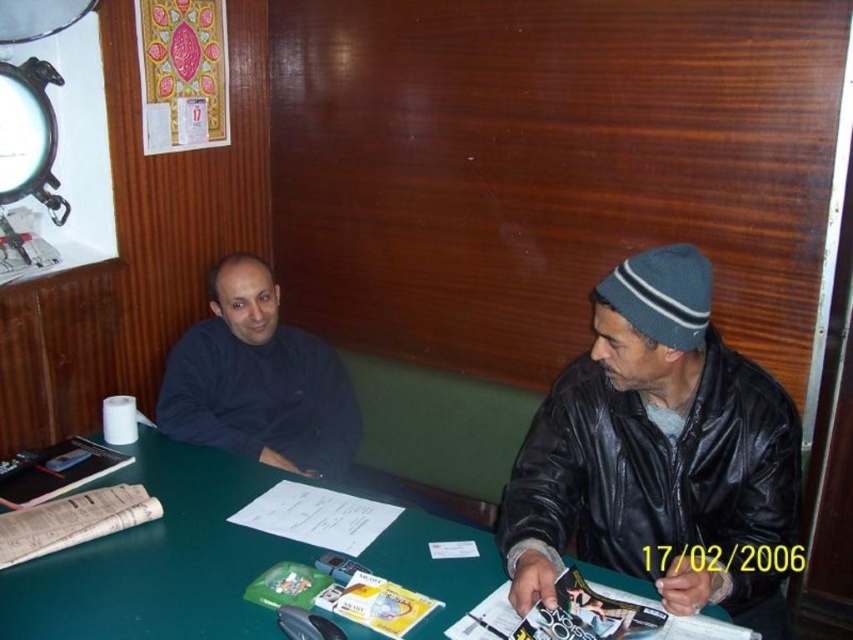
Which of these two, leather jacket at right or green matte table at center, stands taller?

leather jacket at right is taller.

Between point (634, 570) and point (312, 557), which one is positioned behind?

Point (634, 570)

Where is `leather jacket at right`? The width and height of the screenshot is (853, 640). leather jacket at right is located at coordinates (657, 452).

Who is more forward, (x=264, y=484) or (x=235, y=360)?

Point (x=264, y=484)

Does green matte table at center have a larger size compared to dark blue sweater at center?

Indeed, green matte table at center has a larger size compared to dark blue sweater at center.

Where is `green matte table at center`? The height and width of the screenshot is (640, 853). green matte table at center is located at coordinates point(160,560).

Does leather jacket at right have a smaller size compared to dark blue sweater at center?

Actually, leather jacket at right might be larger than dark blue sweater at center.

Is leather jacket at right to the left of dark blue sweater at center from the viewer's perspective?

No, leather jacket at right is not to the left of dark blue sweater at center.

Who is more forward, (776, 467) or (344, 387)?

Point (776, 467) is more forward.

At what (x,y) coordinates should I click in order to perform the action: click on leather jacket at right. Please return your answer as a coordinate pair (x, y). Looking at the image, I should click on (657, 452).